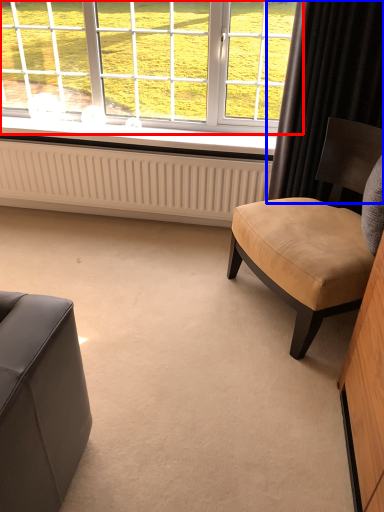
Question: Which object is further to the camera taking this photo, window (highlighted by a red box) or curtain (highlighted by a blue box)?

Choices:
 (A) window
 (B) curtain

Answer: (A)